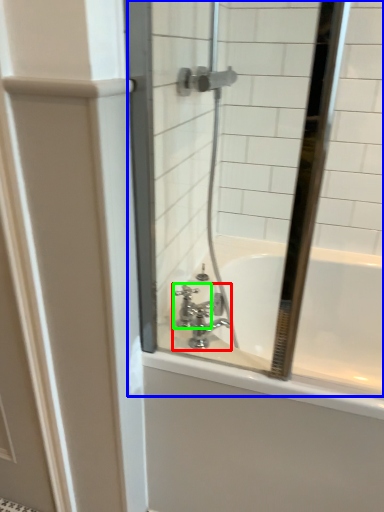
Question: Which is farther away from tap (highlighted by a red box)? mirror (highlighted by a blue box) or faucet (highlighted by a green box)?

Choices:
 (A) mirror
 (B) faucet

Answer: (A)